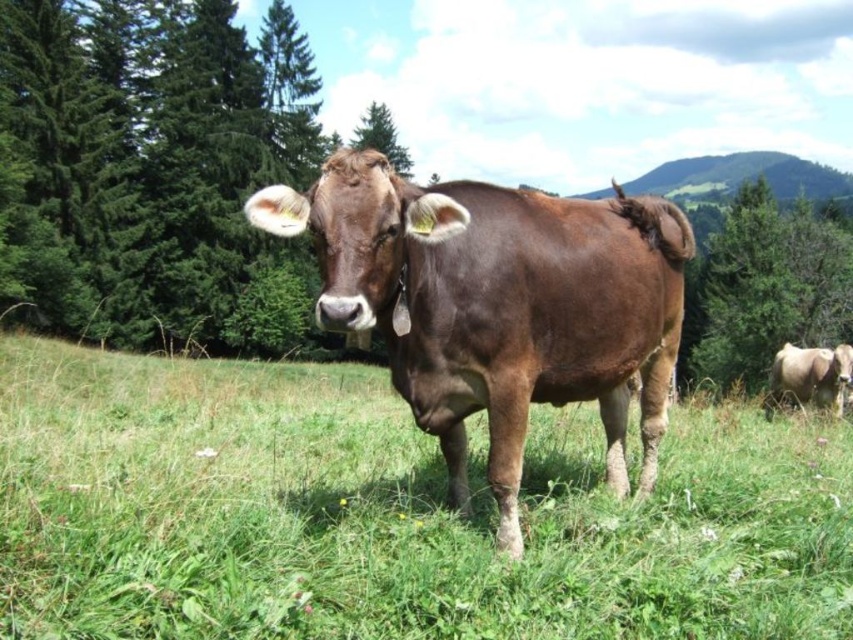
Question: Among these objects, which one is farthest from the camera?

Choices:
 (A) green grassy at center
 (B) green leafy tree at right
 (C) brown smooth cow at center

Answer: (B)

Question: Can you confirm if brown smooth cow at center is bigger than brown smooth cow at right?

Choices:
 (A) no
 (B) yes

Answer: (A)

Question: In this image, where is brown smooth cow at center located relative to green leafy tree at right?

Choices:
 (A) above
 (B) below

Answer: (B)

Question: Which object is the closest to the green grassy at center?

Choices:
 (A) green leafy tree at right
 (B) brown smooth cow at center
 (C) green textured tree at left

Answer: (B)

Question: Which point is closer to the camera taking this photo?

Choices:
 (A) (709, 246)
 (B) (167, 403)
 (C) (399, 289)

Answer: (C)

Question: Is green grassy at center to the left of brown smooth cow at right from the viewer's perspective?

Choices:
 (A) no
 (B) yes

Answer: (B)